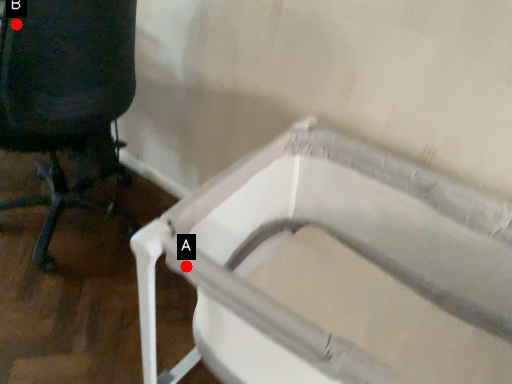
Question: Two points are circled on the image, labeled by A and B beside each circle. Among these points, which one is farthest from the camera?

Choices:
 (A) A is further
 (B) B is further

Answer: (B)